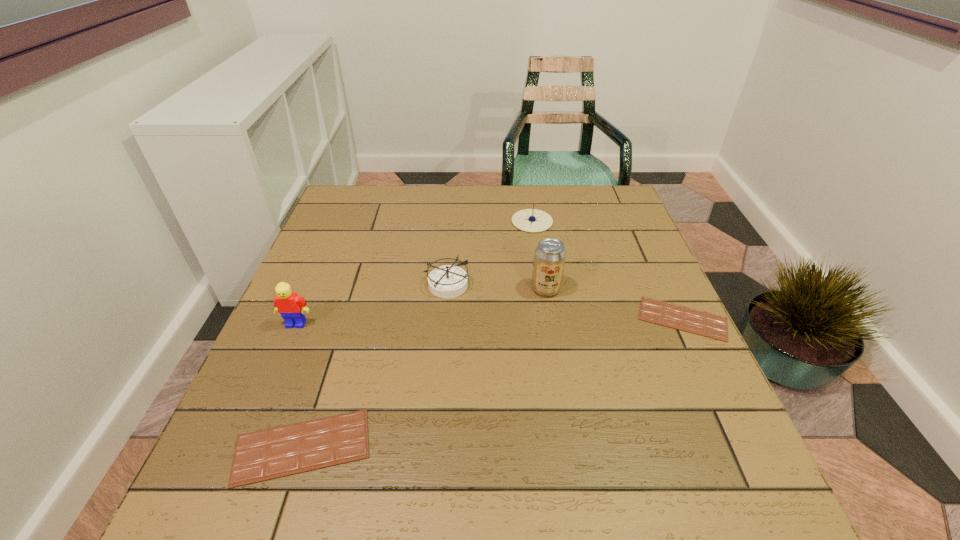
You are a GUI agent. You are given a task and a screenshot of the screen. Output one action in this format:
    pyautogui.click(x=<x>, y=<y>)
    Task: Click on the vacant space positioned 0.230m on the right of the left chocolate bar
    The width and height of the screenshot is (960, 540).
    Given the screenshot: What is the action you would take?
    pyautogui.click(x=504, y=447)

Find the location of `vacant space located on the back of the farther chocolate bar`. vacant space located on the back of the farther chocolate bar is located at coordinates (632, 211).

You are a GUI agent. You are given a task and a screenshot of the screen. Output one action in this format:
    pyautogui.click(x=<x>, y=<y>)
    Task: Click on the free location located on the left of the right compass
    This screenshot has width=960, height=540.
    Given the screenshot: What is the action you would take?
    pyautogui.click(x=437, y=221)

Image resolution: width=960 pixels, height=540 pixels. Identify the location of vacant position located on the front of the left compass. (437, 404).

Identify the location of vacant space located 0.150m on the front-facing side of the Lego. Image resolution: width=960 pixels, height=540 pixels. (270, 386).

Where is `free spot located 0.170m on the back of the beer can`? The height and width of the screenshot is (540, 960). free spot located 0.170m on the back of the beer can is located at coordinates (538, 239).

I want to click on object located at the far edge, so click(x=530, y=220).

The image size is (960, 540). I want to click on object located in the near edge section of the desktop, so click(x=277, y=452).

What are the coordinates of `chocolate bar at the left edge` in the screenshot? It's located at (277, 452).

Locate an element on the screen. This screenshot has height=540, width=960. Lego located in the left edge section of the desktop is located at coordinates (291, 306).